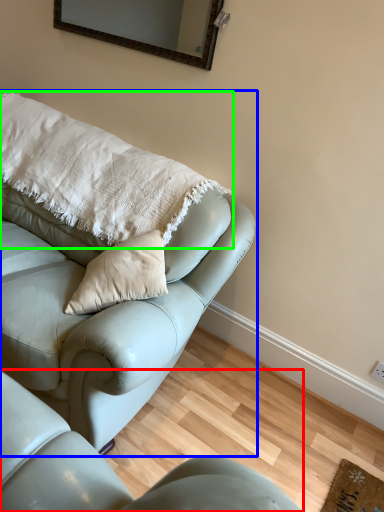
Question: Based on their relative distances, which object is farther from studio couch (highlighted by a red box)? Choose from studio couch (highlighted by a blue box) and pillow (highlighted by a green box).

Choices:
 (A) studio couch
 (B) pillow

Answer: (B)